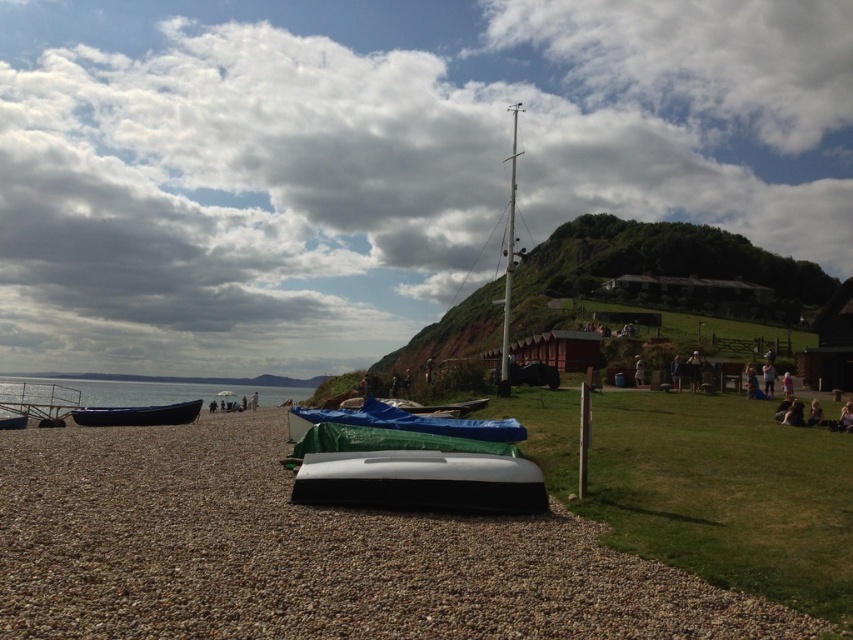
Question: Is the position of white matte boat at center less distant than that of green tarpaulin boat at center?

Choices:
 (A) no
 (B) yes

Answer: (B)

Question: Can you confirm if green grassy hillside at upper right is positioned above white matte boat at center?

Choices:
 (A) no
 (B) yes

Answer: (B)

Question: Is smooth gravel sand at center bigger than green grassy hillside at upper right?

Choices:
 (A) yes
 (B) no

Answer: (B)

Question: Which point is farther to the camera?

Choices:
 (A) (357, 419)
 (B) (515, 458)
 (C) (100, 424)
 (D) (830, 294)

Answer: (D)

Question: Which point appears closest to the camera in this image?

Choices:
 (A) (473, 468)
 (B) (407, 420)
 (C) (677, 300)
 (D) (540, 582)

Answer: (D)

Question: Which of these objects is positioned closest to the white matte boat at center?

Choices:
 (A) blue plastic boat at left
 (B) green tarpaulin boat at center

Answer: (B)